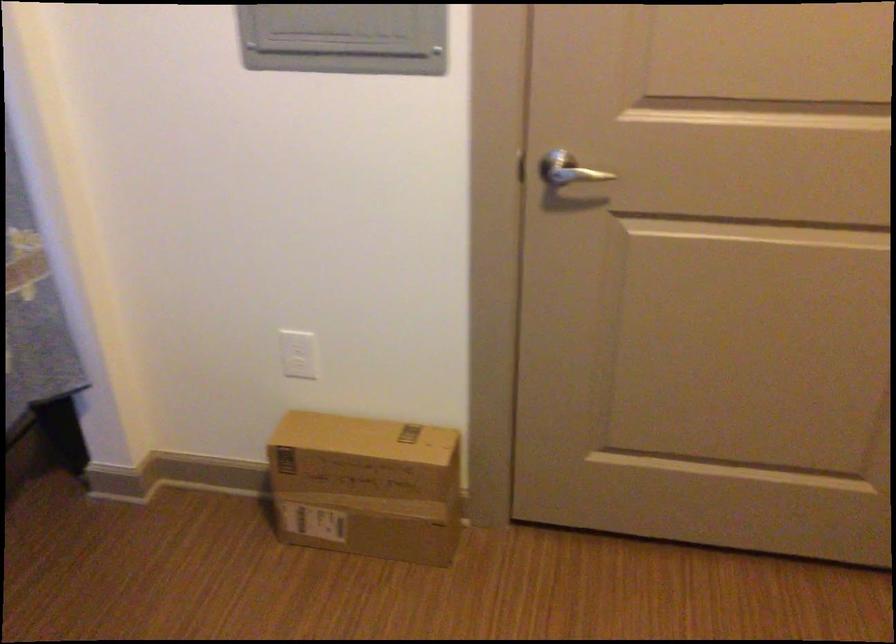
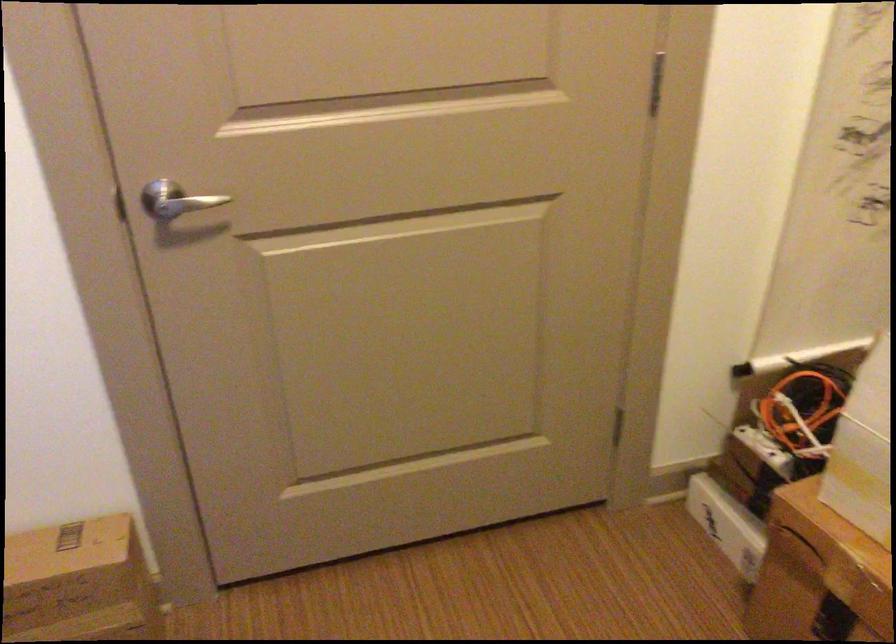
Locate, in the second image, the point that corresponds to point (398, 466) in the first image.

(79, 583)